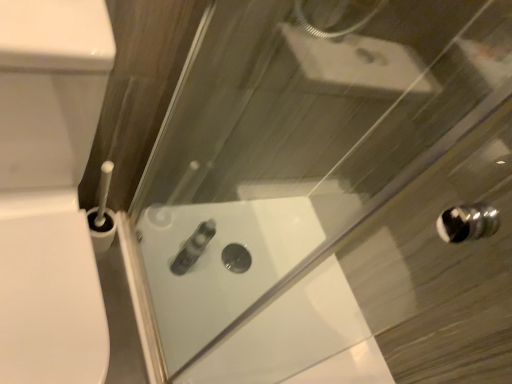
Question: Is satin silver tube at center shorter than white glossy toilet at left?

Choices:
 (A) yes
 (B) no

Answer: (A)

Question: Is satin silver tube at center located outside white glossy toilet at left?

Choices:
 (A) yes
 (B) no

Answer: (A)

Question: From a real-world perspective, is satin silver tube at center under white glossy toilet at left?

Choices:
 (A) no
 (B) yes

Answer: (B)

Question: Considering the relative sizes of satin silver tube at center and white glossy toilet at left in the image provided, is satin silver tube at center smaller than white glossy toilet at left?

Choices:
 (A) yes
 (B) no

Answer: (A)

Question: Can you confirm if satin silver tube at center is wider than white glossy toilet at left?

Choices:
 (A) yes
 (B) no

Answer: (B)

Question: Is white glossy toilet at left to the left or to the right of satin silver tube at center in the image?

Choices:
 (A) right
 (B) left

Answer: (B)

Question: Choose the correct answer: Is white glossy toilet at left inside satin silver tube at center or outside it?

Choices:
 (A) inside
 (B) outside

Answer: (B)

Question: From the image's perspective, relative to satin silver tube at center, is white glossy toilet at left above or below?

Choices:
 (A) above
 (B) below

Answer: (A)

Question: In terms of size, does white glossy toilet at left appear bigger or smaller than satin silver tube at center?

Choices:
 (A) small
 (B) big

Answer: (B)

Question: In the image, is white glossy bath at center on the left side or the right side of satin silver tube at center?

Choices:
 (A) right
 (B) left

Answer: (A)

Question: Considering the positions of white glossy bath at center and satin silver tube at center in the image, is white glossy bath at center taller or shorter than satin silver tube at center?

Choices:
 (A) short
 (B) tall

Answer: (A)

Question: From the image's perspective, is white glossy bath at center located above or below satin silver tube at center?

Choices:
 (A) below
 (B) above

Answer: (A)

Question: In terms of width, does white glossy bath at center look wider or thinner when compared to satin silver tube at center?

Choices:
 (A) thin
 (B) wide

Answer: (B)

Question: In terms of width, does satin silver tube at center look wider or thinner when compared to white glossy toilet at left?

Choices:
 (A) thin
 (B) wide

Answer: (A)

Question: Based on their positions, is satin silver tube at center located to the left or right of white glossy toilet at left?

Choices:
 (A) right
 (B) left

Answer: (A)